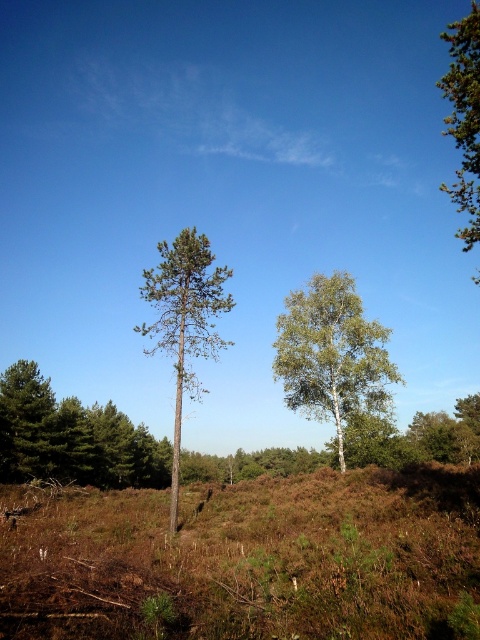
Which is more to the left, smooth white birch at center or green needle-like at upper right?

smooth white birch at center

Does smooth white birch at center have a smaller size compared to green needle-like at upper right?

Indeed, smooth white birch at center has a smaller size compared to green needle-like at upper right.

Between point (194, 307) and point (465, 236), which one is positioned in front?

Point (465, 236)

I want to click on smooth white birch at center, so click(184, 321).

Who is more forward, (0, 536) or (20, 417)?

Positioned in front is point (0, 536).

Is point (117, 628) positioned after point (156, 477)?

No.

Who is more forward, (222, 589) or (69, 417)?

Point (222, 589) is more forward.

This screenshot has width=480, height=640. I want to click on brown grassy hillside at center, so click(x=248, y=560).

Is green matte tree at center to the left of white smooth birch tree at center from the viewer's perspective?

Correct, you'll find green matte tree at center to the left of white smooth birch tree at center.

Is green matte tree at center taller than white smooth birch tree at center?

Correct, green matte tree at center is much taller as white smooth birch tree at center.

Between point (122, 419) and point (319, 330), which one is positioned behind?

The point (122, 419) is more distant.

Where is `green matte tree at center`? The width and height of the screenshot is (480, 640). green matte tree at center is located at coordinates (72, 436).